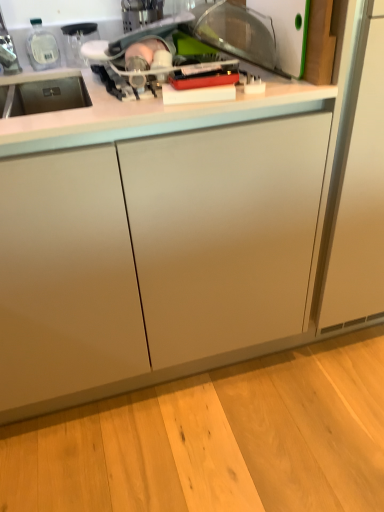
Question: Is white glossy countertop at upper center to the left or to the right of white plastic cutting board at upper right in the image?

Choices:
 (A) right
 (B) left

Answer: (B)

Question: Is point (107, 137) closer or farther from the camera than point (291, 51)?

Choices:
 (A) closer
 (B) farther

Answer: (A)

Question: In terms of width, does white glossy countertop at upper center look wider or thinner when compared to white plastic cutting board at upper right?

Choices:
 (A) thin
 (B) wide

Answer: (B)

Question: Is point (233, 41) closer or farther from the camera than point (44, 118)?

Choices:
 (A) closer
 (B) farther

Answer: (B)

Question: In terms of height, does white plastic cutting board at upper right look taller or shorter compared to white glossy countertop at upper center?

Choices:
 (A) tall
 (B) short

Answer: (B)

Question: From a real-world perspective, is white plastic cutting board at upper right physically located above or below white glossy countertop at upper center?

Choices:
 (A) below
 (B) above

Answer: (A)

Question: Based on their positions, is white plastic cutting board at upper right located to the left or right of white glossy countertop at upper center?

Choices:
 (A) right
 (B) left

Answer: (A)